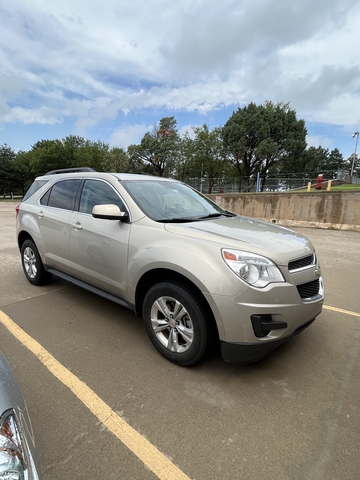
This screenshot has width=360, height=480. What are the coordinates of `hood` in the screenshot? It's located at (274, 247).